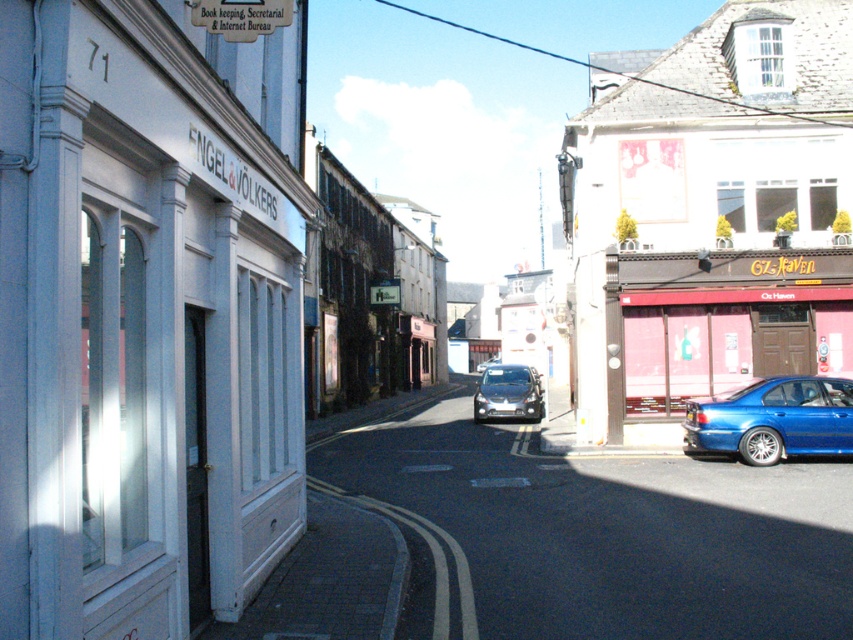
Can you confirm if metallic blue car at right is wider than shiny silver car at center?

Correct, the width of metallic blue car at right exceeds that of shiny silver car at center.

Who is lower down, metallic blue car at right or shiny silver car at center?

Positioned lower is shiny silver car at center.

Is point (804, 51) positioned after point (512, 397)?

No.

Find the location of a particular element. metallic blue car at right is located at coordinates (712, 216).

Which is more to the left, pink matte door at right or glossy blue sedan at lower right?

Positioned to the left is glossy blue sedan at lower right.

Can you confirm if pink matte door at right is thinner than glossy blue sedan at lower right?

No.

Is point (846, 333) positioned before point (711, 445)?

That is False.

Identify the location of pink matte door at right. This screenshot has height=640, width=853. (718, 323).

Does metallic blue car at right have a lesser width compared to glossy blue sedan at lower right?

Incorrect, metallic blue car at right's width is not less than glossy blue sedan at lower right's.

Between metallic blue car at right and glossy blue sedan at lower right, which one appears on the left side from the viewer's perspective?

glossy blue sedan at lower right

Does point (602, 211) come farther from viewer compared to point (688, 413)?

Yes, point (602, 211) is behind point (688, 413).

At what (x,y) coordinates should I click in order to perform the action: click on metallic blue car at right. Please return your answer as a coordinate pair (x, y). Looking at the image, I should click on (712, 216).